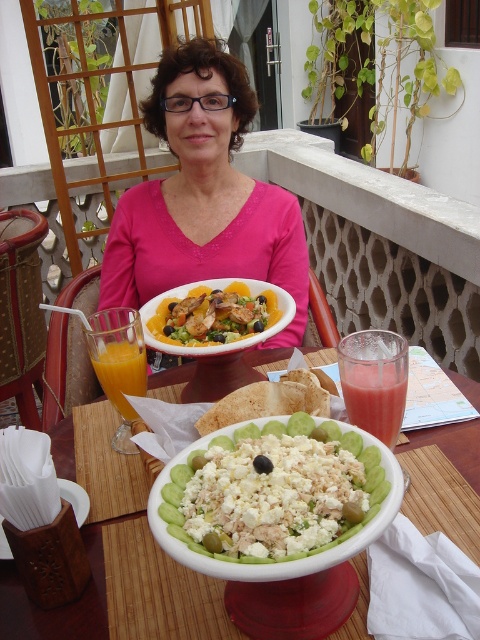
Question: Which point appears closest to the camera in this image?

Choices:
 (A) (405, 394)
 (B) (260, 504)
 (C) (145, 99)
 (D) (74, 490)

Answer: (B)

Question: Which point is closer to the camera taking this photo?

Choices:
 (A) (371, 456)
 (B) (73, 480)
 (C) (83, 522)

Answer: (A)

Question: Which object is farther from the camera taking this photo?

Choices:
 (A) white ceramic bowl at center
 (B) orange liquid at left
 (C) pink fabric shirt at center

Answer: (C)

Question: Is white crumbly cheese salad at center positioned behind orange liquid at left?

Choices:
 (A) no
 (B) yes

Answer: (A)

Question: Is pink fabric shirt at center to the right of white ceramic bowl at center from the viewer's perspective?

Choices:
 (A) no
 (B) yes

Answer: (A)

Question: Is white crumbly cheese salad at center further to the viewer compared to white ceramic bowl at center?

Choices:
 (A) no
 (B) yes

Answer: (A)